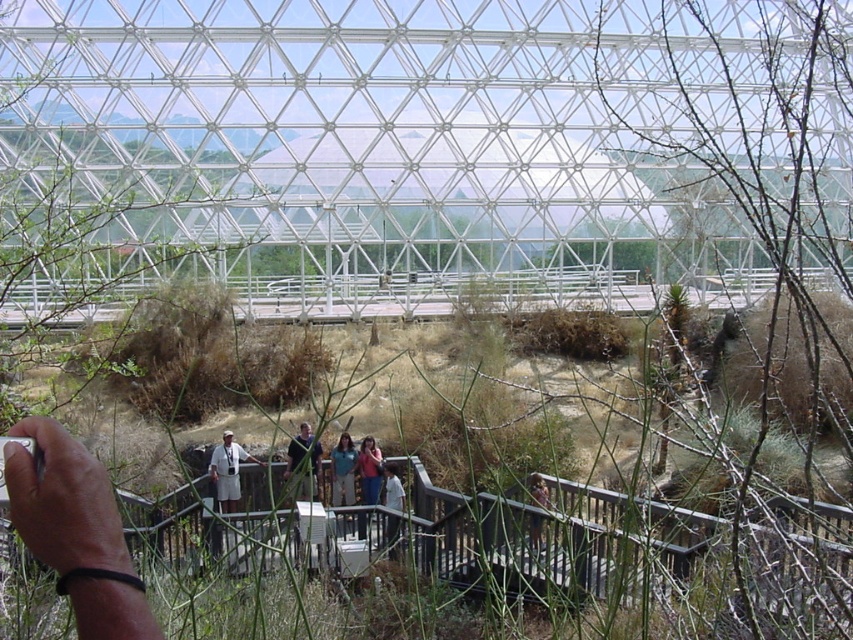
What do you see at coordinates (369, 470) in the screenshot?
I see `matte pink shirt at center` at bounding box center [369, 470].

Does point (375, 460) come in front of point (529, 518)?

No, (375, 460) is behind (529, 518).

What do you see at coordinates (369, 470) in the screenshot? I see `matte pink shirt at center` at bounding box center [369, 470].

Locate an element on the screen. matte pink shirt at center is located at coordinates (369, 470).

Does blue denim jeans at center appear on the left side of light brown wooden post at center?

Correct, you'll find blue denim jeans at center to the left of light brown wooden post at center.

Who is more forward, [341,445] or [538,525]?

Positioned in front is point [538,525].

Image resolution: width=853 pixels, height=640 pixels. Find the location of `blue denim jeans at center`. blue denim jeans at center is located at coordinates (343, 470).

Is dark blue shirt at center shorter than matte pink shirt at center?

Incorrect, dark blue shirt at center's height does not fall short of matte pink shirt at center's.

Which is above, dark blue shirt at center or matte pink shirt at center?

dark blue shirt at center

At what (x,y) coordinates should I click in order to perform the action: click on dark blue shirt at center. Please return your answer as a coordinate pair (x, y). Looking at the image, I should click on pos(305,460).